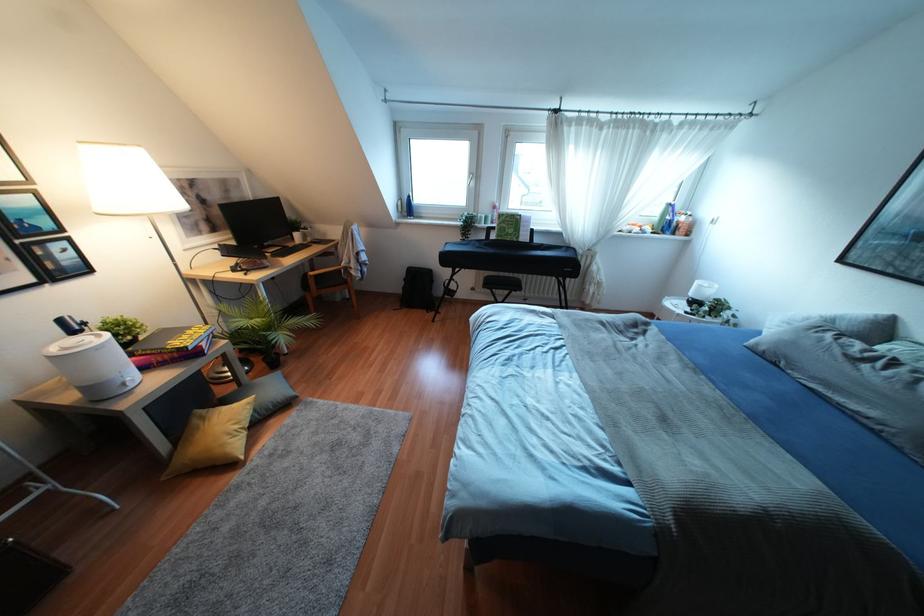
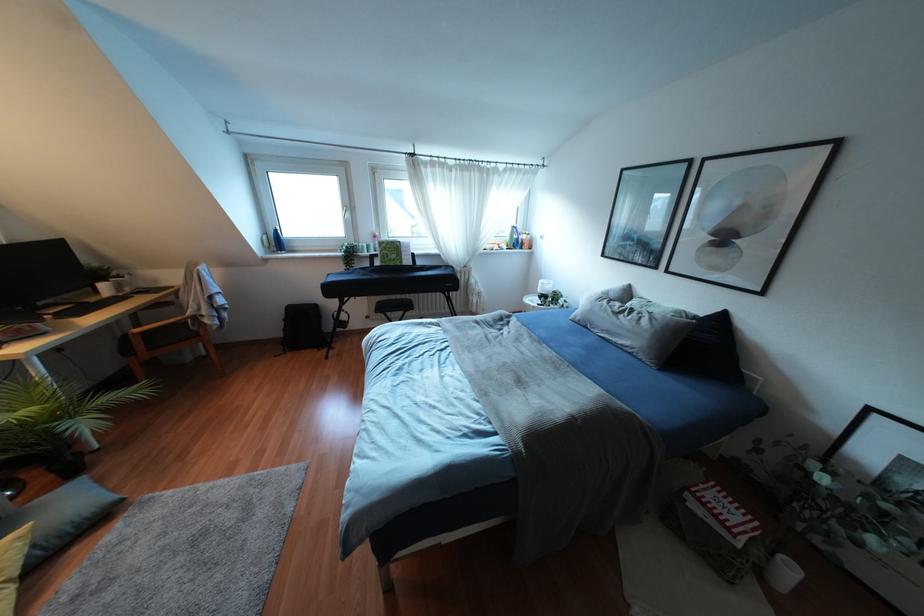
Where in the second image is the point corresponding to point (403, 286) from the first image?

(284, 329)